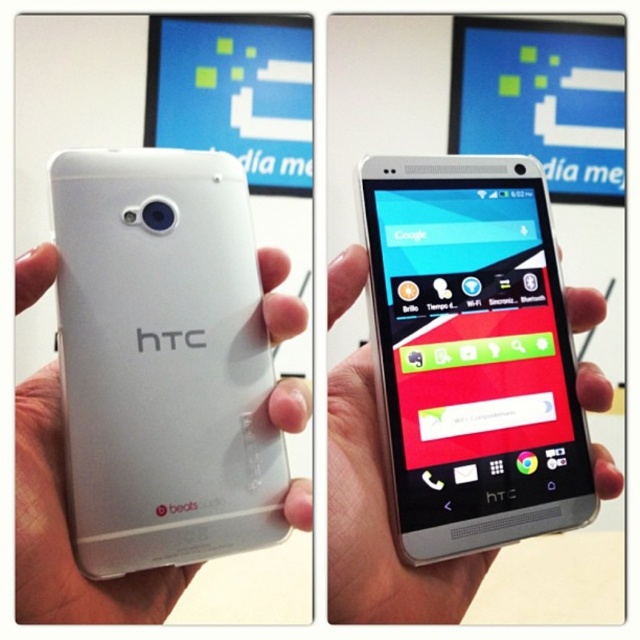
Question: Among these points, which one is nearest to the camera?

Choices:
 (A) (356, 390)
 (B) (45, 518)

Answer: (B)

Question: Is white matte phone at center to the right of white matte htc phone at center from the viewer's perspective?

Choices:
 (A) yes
 (B) no

Answer: (A)

Question: Which object appears farthest from the camera in this image?

Choices:
 (A) white matte phone at center
 (B) white matte htc phone at center

Answer: (A)

Question: Which point is farther to the camera?

Choices:
 (A) white matte phone at center
 (B) white matte htc phone at center

Answer: (A)

Question: Can you confirm if white matte phone at center is wider than white matte htc phone at center?

Choices:
 (A) yes
 (B) no

Answer: (A)

Question: Considering the relative positions of white matte phone at center and white matte htc phone at center in the image provided, where is white matte phone at center located with respect to white matte htc phone at center?

Choices:
 (A) above
 (B) below

Answer: (B)